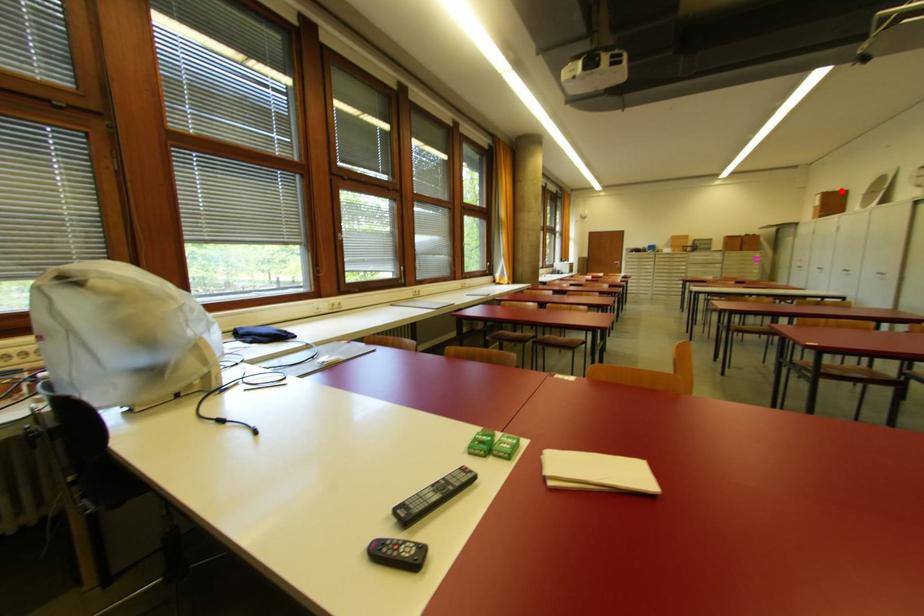
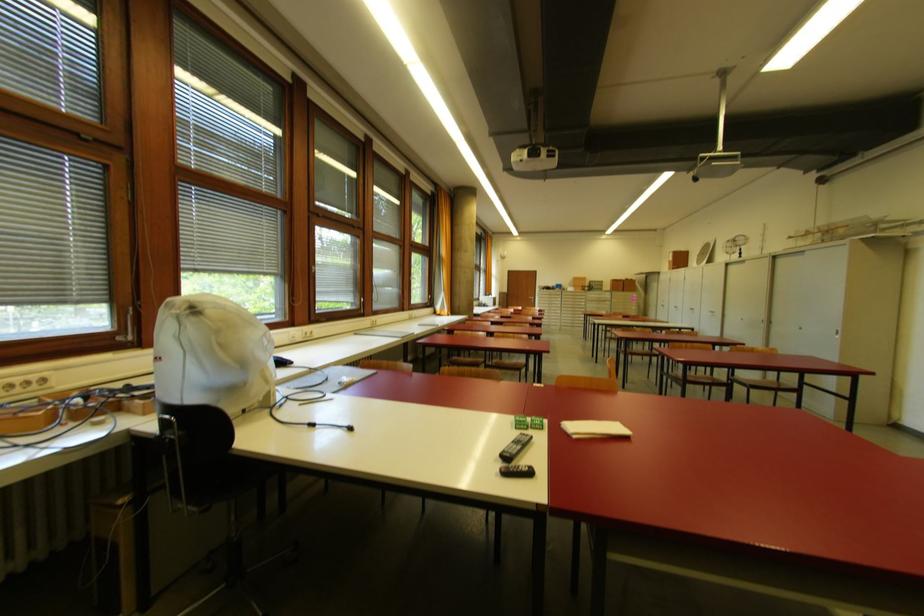
Where in the second image is the point corresponding to the highlighted location from the first image?

(686, 251)